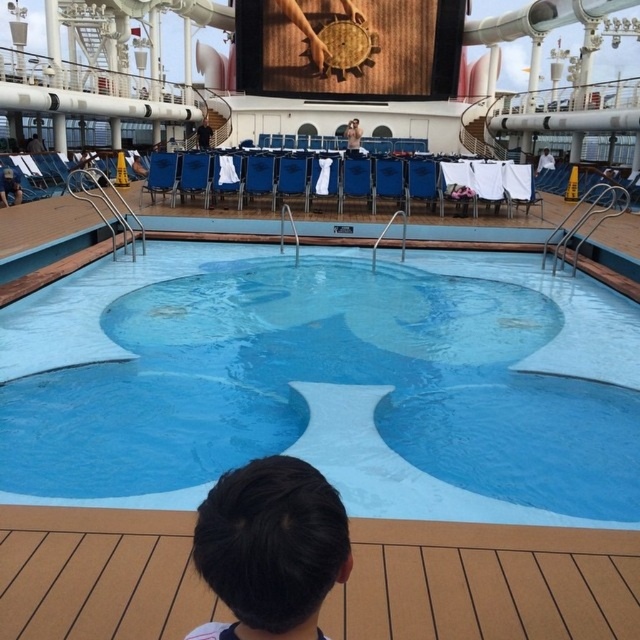
Who is more distant from viewer, (76, 310) or (502, 573)?

Positioned behind is point (76, 310).

Does blue smooth pool at center appear under brown wood deck at lower center?

Incorrect, blue smooth pool at center is not positioned below brown wood deck at lower center.

Who is more forward, [196,259] or [200,588]?

Point [200,588] is more forward.

This screenshot has height=640, width=640. Find the location of `blue smooth pool at center`. blue smooth pool at center is located at coordinates (326, 384).

Does blue smooth pool at center have a greater width compared to blue fabric chair at center?

Indeed, blue smooth pool at center has a greater width compared to blue fabric chair at center.

Does blue smooth pool at center appear over blue fabric chair at center?

Actually, blue smooth pool at center is below blue fabric chair at center.

Who is more distant from viewer, (234, 337) or (172, 186)?

The point (172, 186) is more distant.

I want to click on blue smooth pool at center, so click(326, 384).

Is brown wood deck at lower center taller than dark brown hair at lower center?

Incorrect, brown wood deck at lower center's height is not larger of dark brown hair at lower center's.

Can you confirm if brown wood deck at lower center is shorter than dark brown hair at lower center?

Indeed, brown wood deck at lower center has a lesser height compared to dark brown hair at lower center.

Between point (417, 600) and point (305, 600), which one is positioned in front?

Point (305, 600)

This screenshot has width=640, height=640. Identify the location of brown wood deck at lower center. (486, 582).